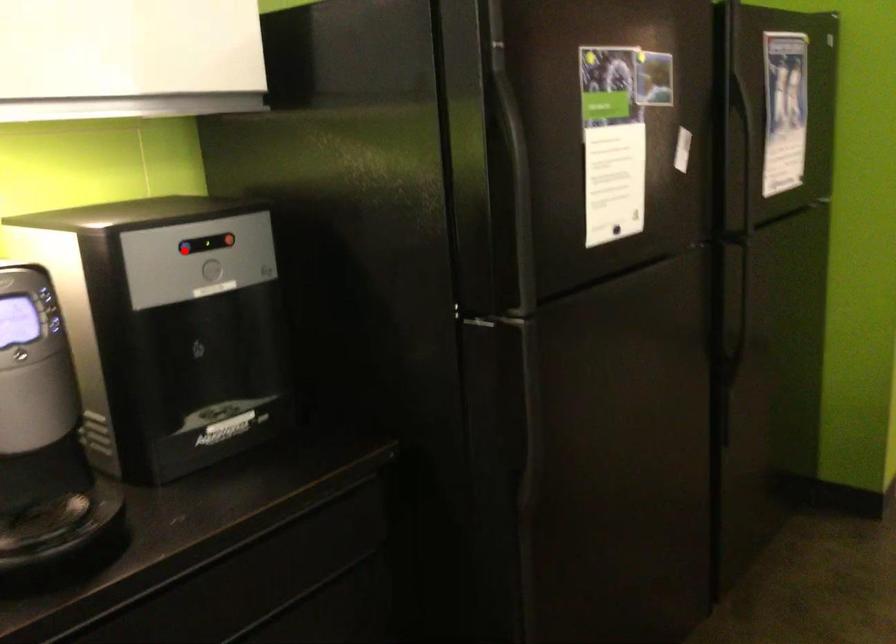
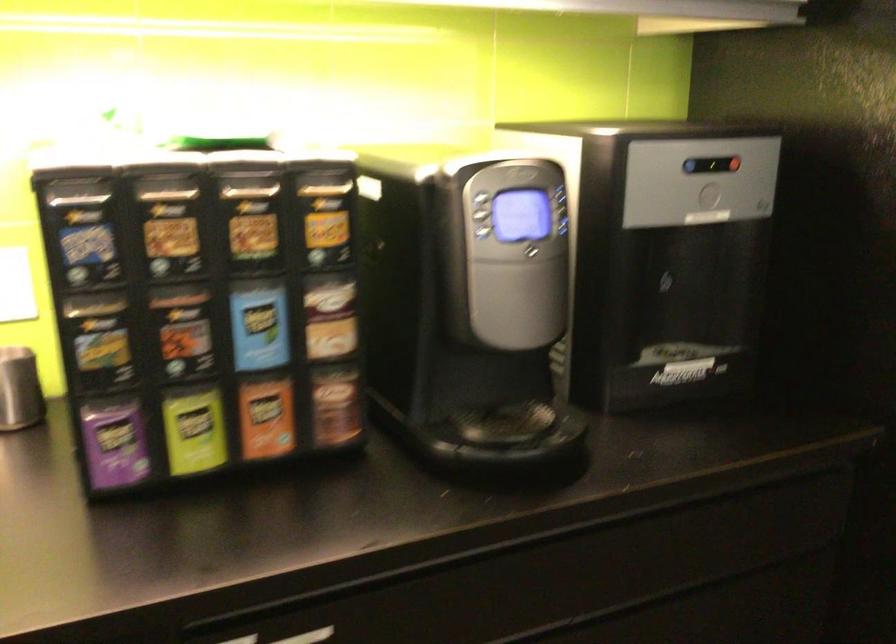
Question: I am providing you with two images of the same scene from different viewpoints. Image1 has a red point marked. In image2, the corresponding 3D location appears at what relative position? Reply with the corresponding letter.

Choices:
 (A) Closer
 (B) Farther

Answer: (A)